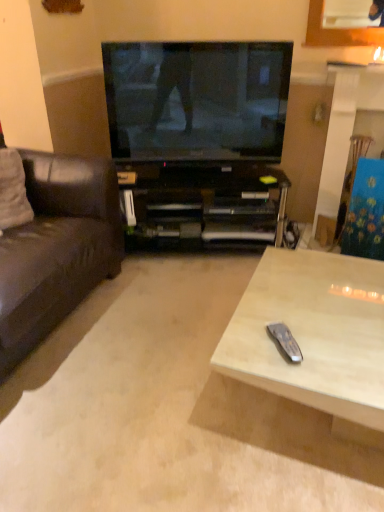
This screenshot has width=384, height=512. What are the coordinates of `blank area beneath light wood/texture remote control at lower right (from a real-world perspective)` in the screenshot? It's located at (291, 429).